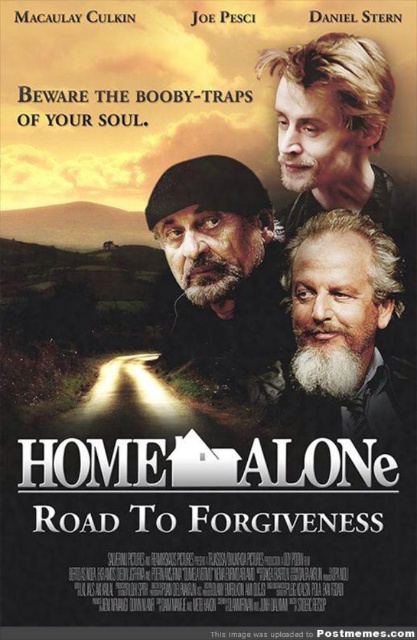
Who is more forward, (x=349, y=392) or (x=294, y=144)?

Positioned in front is point (x=294, y=144).

Which is behind, point (367, 317) or point (356, 189)?

Positioned behind is point (367, 317).

This screenshot has height=640, width=417. I want to click on gray beard at lower right, so click(x=346, y=330).

How much distance is there between gray beard at center and blonde hair at upper right?

gray beard at center and blonde hair at upper right are 1.31 meters apart.

Is gray beard at center below blonde hair at upper right?

Yes.

In order to click on gray beard at center in this screenshot , I will do `click(221, 276)`.

The height and width of the screenshot is (640, 417). I want to click on gray beard at center, so click(221, 276).

Describe the element at coordinates (221, 276) in the screenshot. This screenshot has width=417, height=640. I see `gray beard at center` at that location.

Does gray beard at center lie in front of gray beard at lower right?

That is True.

Between point (201, 257) and point (321, 269), which one is positioned behind?

The point (321, 269) is more distant.

What are the coordinates of `gray beard at center` in the screenshot? It's located at pos(221,276).